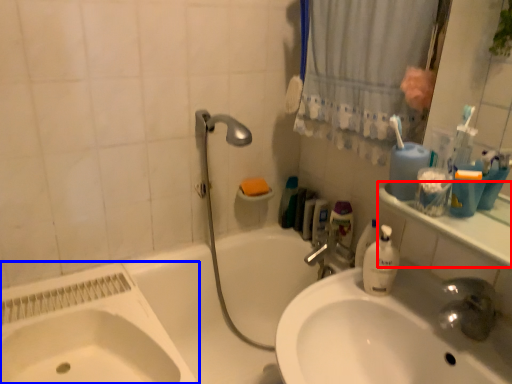
Question: Which object is further to the camera taking this photo, counter top (highlighted by a red box) or sink (highlighted by a blue box)?

Choices:
 (A) counter top
 (B) sink

Answer: (B)